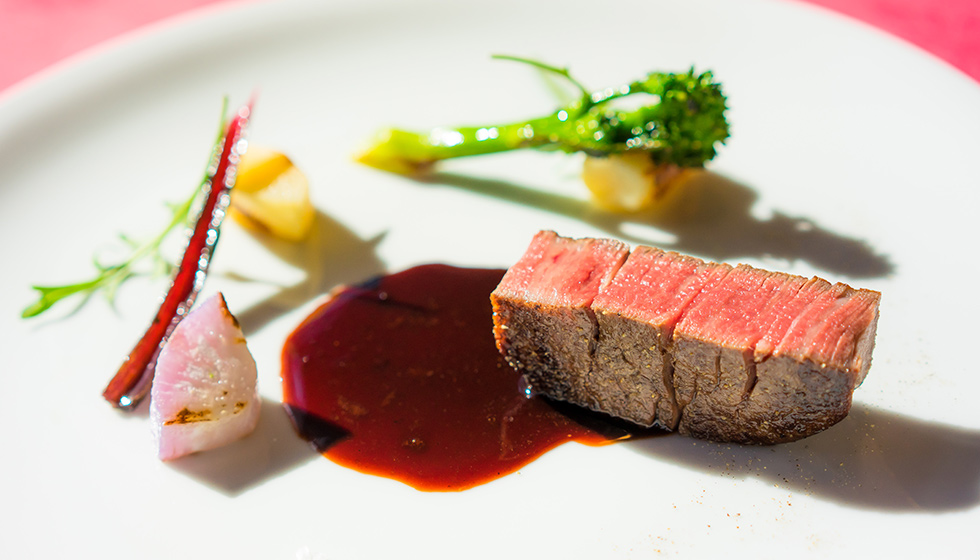
Locate an element on the screen. Image resolution: width=980 pixels, height=560 pixels. plate is located at coordinates (817, 110).